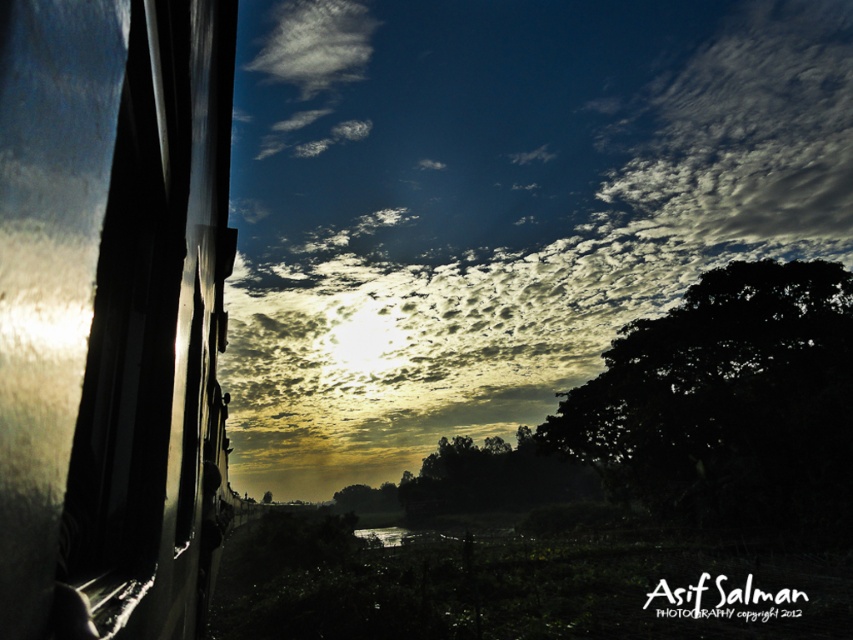
Identify the location of cloudy sky at upper center. This screenshot has height=640, width=853. (498, 204).

Measure the distance between point (737, 140) and camera.

The distance of point (737, 140) from camera is 160.87 meters.

Is point (532, 416) behind point (685, 445)?

Yes, it is.

At what (x,y) coordinates should I click in order to perform the action: click on cloudy sky at upper center. Please return your answer as a coordinate pair (x, y). The image size is (853, 640). Looking at the image, I should click on (498, 204).

Between point (149, 209) and point (688, 365), which one is positioned behind?

Positioned behind is point (688, 365).

Is frosted glass train window at left to the right of dark green leafy tree at right from the viewer's perspective?

No, frosted glass train window at left is not to the right of dark green leafy tree at right.

The height and width of the screenshot is (640, 853). Describe the element at coordinates (112, 314) in the screenshot. I see `frosted glass train window at left` at that location.

Identify the location of frosted glass train window at left. The width and height of the screenshot is (853, 640). (112, 314).

Between point (302, 193) and point (181, 358), which one is positioned in front?

Point (181, 358) is in front.

Does point (354, 83) come in front of point (183, 525)?

No, (354, 83) is further to viewer.

Where is `cloudy sky at upper center`? This screenshot has width=853, height=640. cloudy sky at upper center is located at coordinates (498, 204).